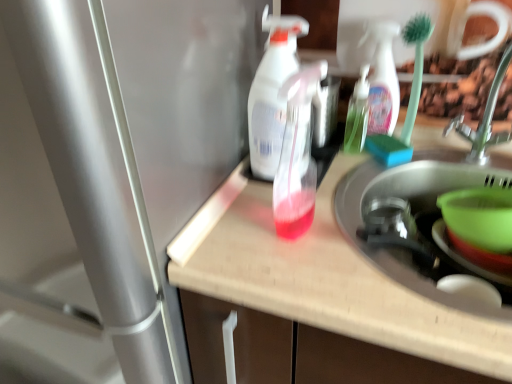
Find the location of a particular element. The width and height of the screenshot is (512, 384). vacant area that is in front of translucent plastic spray bottle at center, the 1th bottle in the left-to-right sequence is located at coordinates (326, 282).